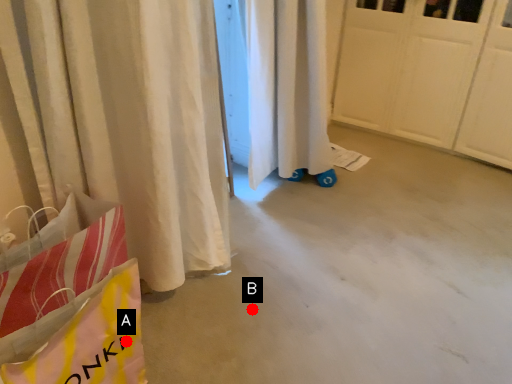
Question: Two points are circled on the image, labeled by A and B beside each circle. Among these points, which one is farthest from the camera?

Choices:
 (A) A is further
 (B) B is further

Answer: (B)